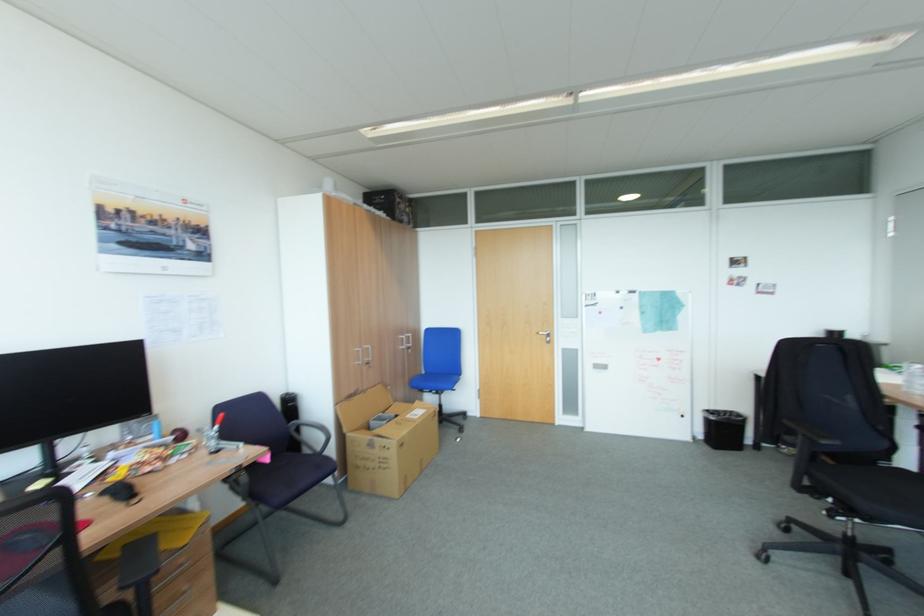
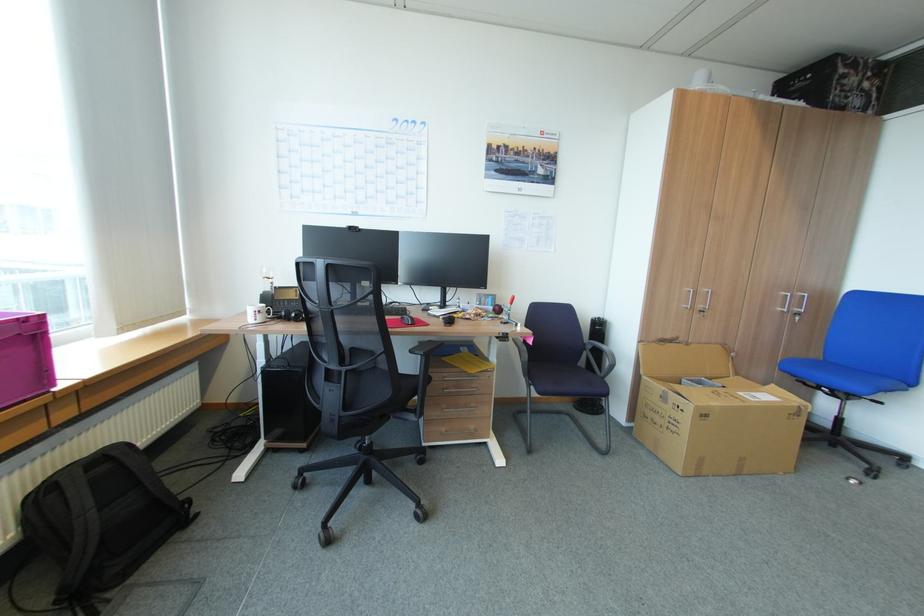
Question: The first image is from the beginning of the video and the second image is from the end. How did the camera likely rotate when shooting the video?

Choices:
 (A) Left
 (B) Right
 (C) Up
 (D) Down

Answer: (A)